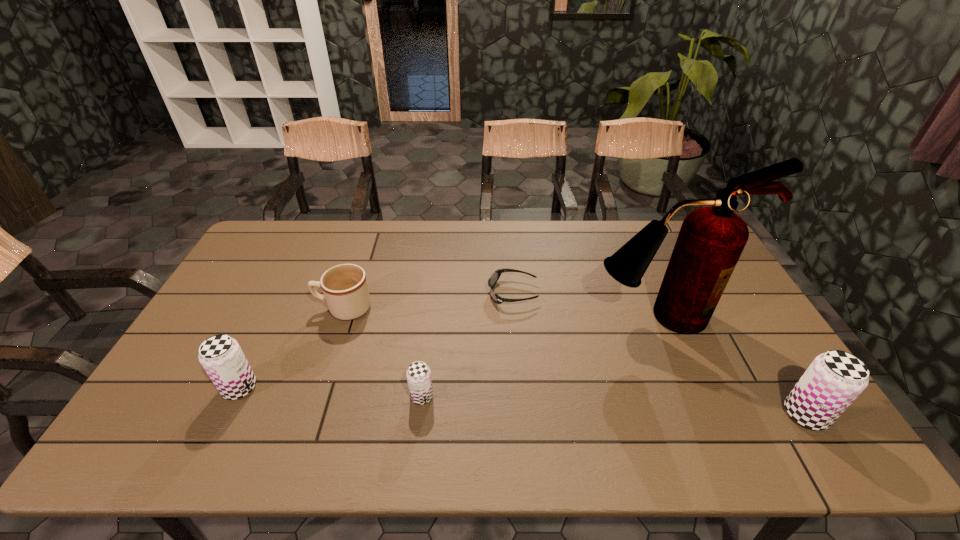
Identify which object is the second nearest to the fourth shortest object. Please provide its 2D coordinates. Your answer should be formatted as a tuple, i.e. [(x, y)], where the tuple contains the x and y coordinates of a point satisfying the conditions above.

[(418, 374)]

The width and height of the screenshot is (960, 540). Find the location of `the third closest object to the rightmost beer can`. the third closest object to the rightmost beer can is located at coordinates (418, 374).

At what (x,y) coordinates should I click in order to perform the action: click on beer can that is the closest one to the rightmost beer can. Please return your answer as a coordinate pair (x, y). The image size is (960, 540). Looking at the image, I should click on (418, 374).

Where is `the second closest beer can relative to the leftmost beer can`? The image size is (960, 540). the second closest beer can relative to the leftmost beer can is located at coordinates coord(834,379).

Locate an element on the screen. This screenshot has height=540, width=960. vacant space that satisfies the following two spatial constraints: 1. on the lenses of the sunglasses; 2. on the back side of the rightmost beer can is located at coordinates (522, 414).